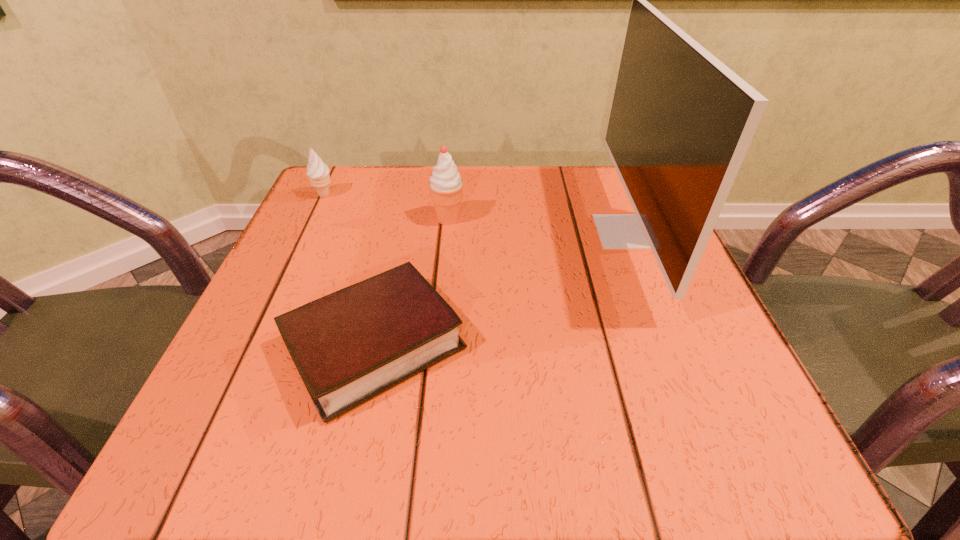
At what (x,y) coordinates should I click in order to perform the action: click on the rightmost object. Please return your answer as a coordinate pair (x, y). The width and height of the screenshot is (960, 540). Looking at the image, I should click on (681, 122).

Where is `the tallest object`? the tallest object is located at coordinates (681, 122).

I want to click on the taller icecream, so click(446, 186).

Identify the location of the right icecream. (446, 186).

The width and height of the screenshot is (960, 540). In order to click on the left icecream in this screenshot , I will do `click(318, 172)`.

Where is `the leftmost object`? The image size is (960, 540). the leftmost object is located at coordinates (318, 172).

Find the location of a particular element. This screenshot has height=540, width=960. Bible is located at coordinates (349, 346).

Locate an element on the screen. vacant region located 0.160m on the front-facing side of the rightmost object is located at coordinates (516, 231).

The height and width of the screenshot is (540, 960). In order to click on free space located 0.240m on the front-facing side of the rightmost object in this screenshot , I will do `click(475, 231)`.

Image resolution: width=960 pixels, height=540 pixels. I want to click on vacant region located 0.060m on the front-facing side of the rightmost object, so click(567, 231).